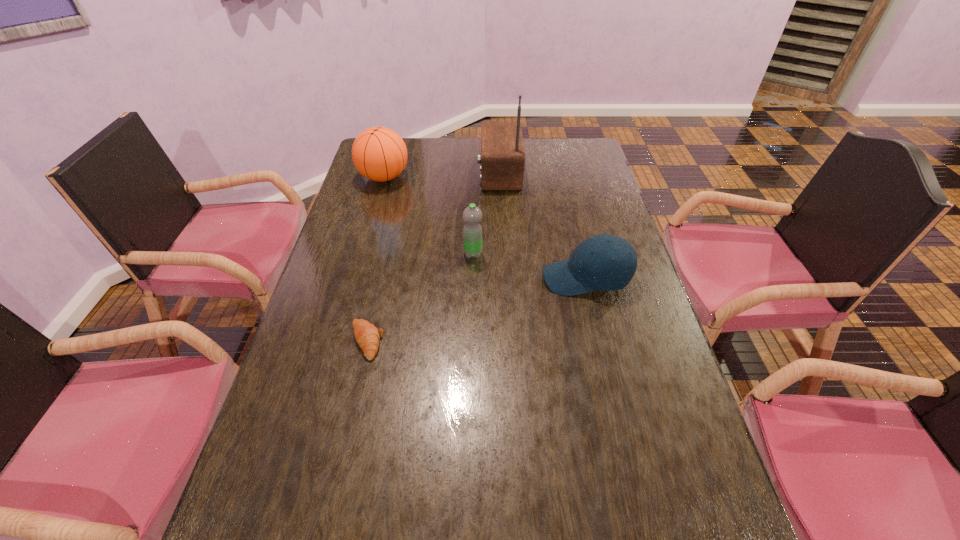
What are the coordinates of `object at the right edge` in the screenshot? It's located at point(604,262).

The height and width of the screenshot is (540, 960). Find the location of `object present at the far left corner`. object present at the far left corner is located at coordinates (379, 154).

Where is `vacant space at the far edge of the desktop`? vacant space at the far edge of the desktop is located at coordinates (413, 144).

The image size is (960, 540). In the image, there is a desktop. Identify the location of free space at the left edge. (355, 347).

Where is `free space at the right edge of the desktop`? The image size is (960, 540). free space at the right edge of the desktop is located at coordinates (589, 209).

At what (x,y) coordinates should I click in order to perform the action: click on vacant area at the far left corner. Please return your answer as a coordinate pair (x, y). The width and height of the screenshot is (960, 540). Looking at the image, I should click on (408, 151).

In order to click on free space at the far right corner of the desktop in this screenshot , I will do `click(587, 160)`.

Identify the location of unoccupied area between the basketball and the nearest object. This screenshot has height=540, width=960. (375, 259).

Identify the location of empty location between the basketball and the water bottle. This screenshot has height=540, width=960. (428, 215).

Identify the location of free area in between the shortest object and the basketball. The image size is (960, 540). (375, 259).